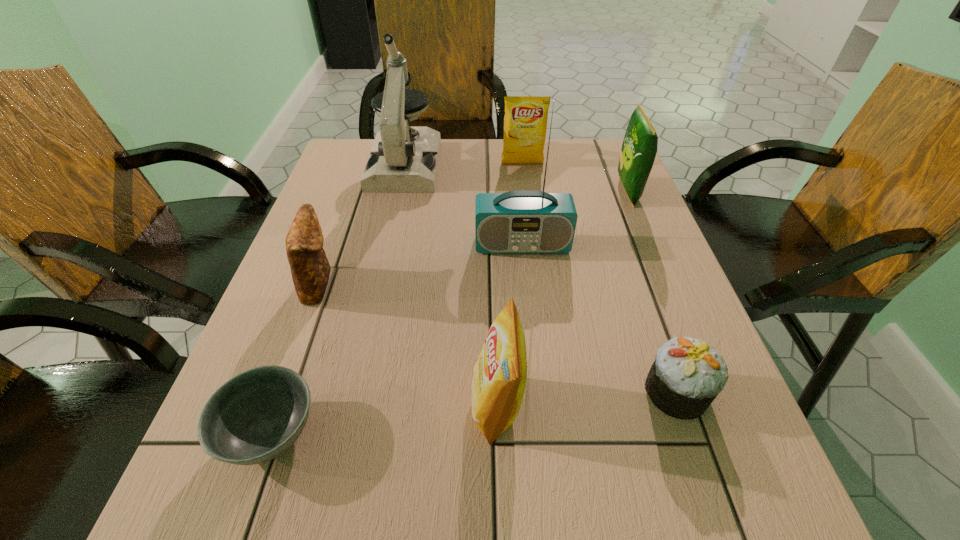
Where is `blank area located on the front panel of the radio receiver`? blank area located on the front panel of the radio receiver is located at coordinates click(528, 306).

The height and width of the screenshot is (540, 960). Find the location of `free space located on the front-facing side of the rightmost crisp (potato chip)`. free space located on the front-facing side of the rightmost crisp (potato chip) is located at coordinates (531, 192).

The width and height of the screenshot is (960, 540). I want to click on free space located on the front-facing side of the rightmost crisp (potato chip), so click(512, 192).

Image resolution: width=960 pixels, height=540 pixels. Identify the location of free space located on the front-facing side of the rightmost crisp (potato chip). [x=570, y=192].

You are a GUI agent. You are given a task and a screenshot of the screen. Output one action in this format:
    pyautogui.click(x=<x>, y=<y>)
    Task: Click on the vacant position located on the front of the farthest crisp (potato chip) with the logo
    The width and height of the screenshot is (960, 540).
    Given the screenshot: What is the action you would take?
    pyautogui.click(x=528, y=209)

You are a GUI agent. You are given a task and a screenshot of the screen. Output one action in this format:
    pyautogui.click(x=<x>, y=<y>)
    Task: Click on the vacant space situated 0.160m on the front-facing side of the nearest crisp (potato chip)
    
    Given the screenshot: What is the action you would take?
    pyautogui.click(x=372, y=405)

Identify the location of blank space located on the front-facing side of the nearest crisp (potato chip). (242, 405).

Locate an element on the screen. This screenshot has width=960, height=540. vacant space located 0.110m on the front-facing side of the nearest crisp (potato chip) is located at coordinates (403, 405).

Find the location of a particular element. The image size is (960, 540). vacant space situated on the open side of the fourth nearest object is located at coordinates (458, 284).

The image size is (960, 540). Identify the location of free space located on the left of the cupcake. (450, 392).